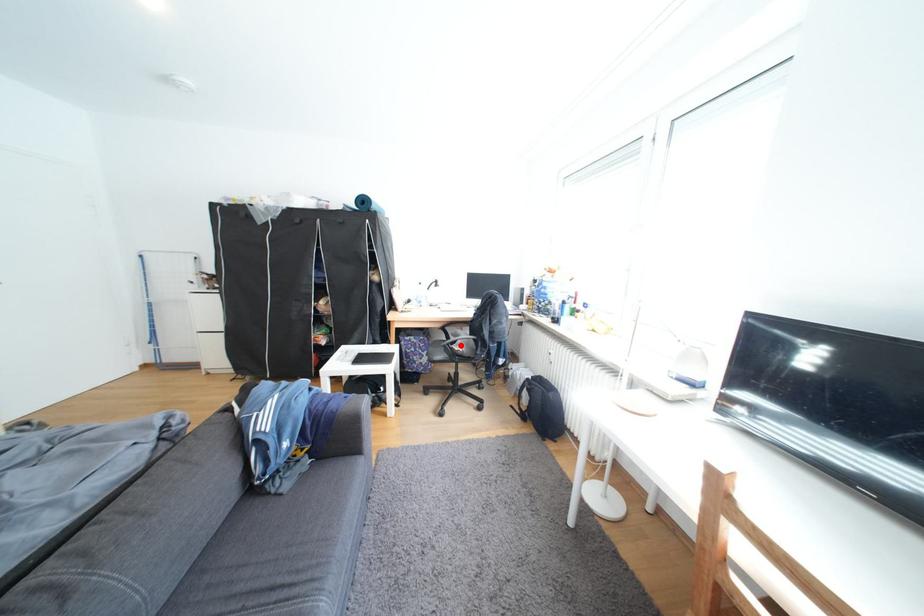
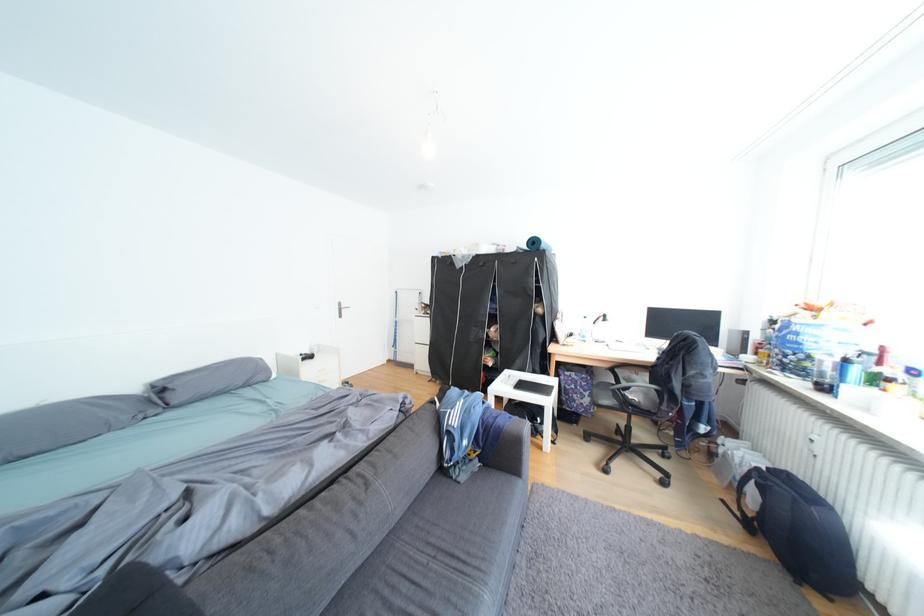
Find the pixel in the second image that matches the highlighted location in the first image.

(631, 390)